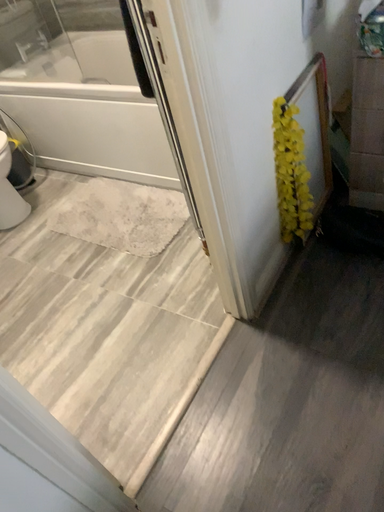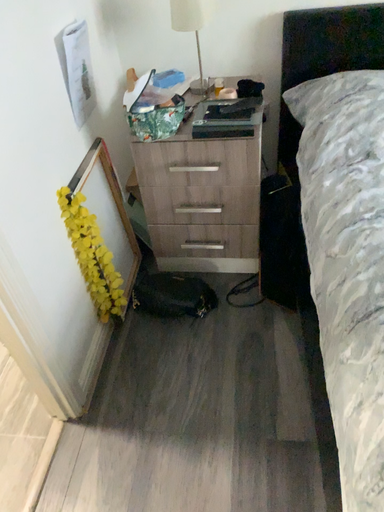
Question: Which way did the camera rotate in the video?

Choices:
 (A) rotated left
 (B) rotated right

Answer: (B)